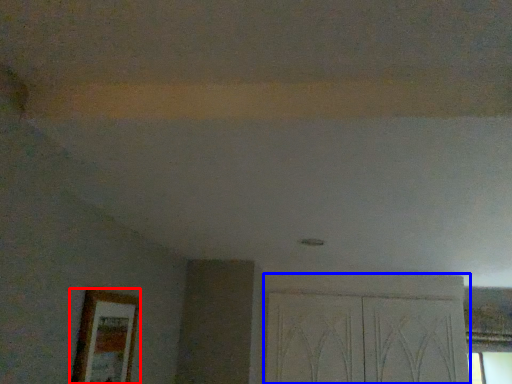
Question: Which object appears farthest to the camera in this image, picture frame (highlighted by a red box) or screen door (highlighted by a blue box)?

Choices:
 (A) picture frame
 (B) screen door

Answer: (B)